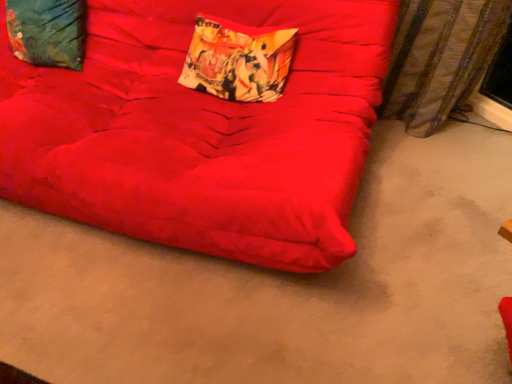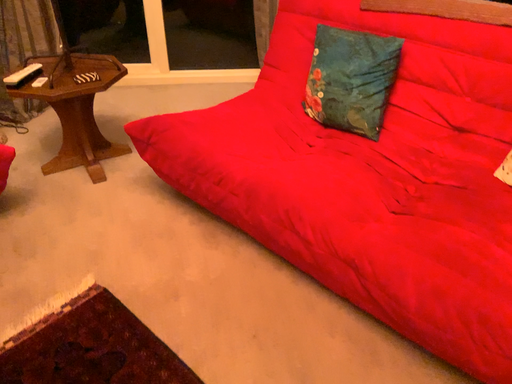
Question: Which way did the camera rotate in the video?

Choices:
 (A) rotated upward
 (B) rotated downward

Answer: (A)